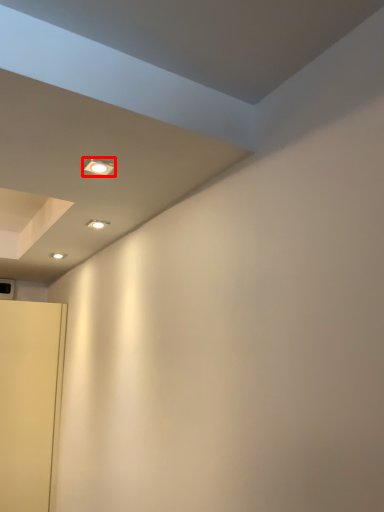
Question: Observing the image, what is the correct spatial positioning of light fixture (annotated by the red box) in reference to door?

Choices:
 (A) left
 (B) right

Answer: (B)